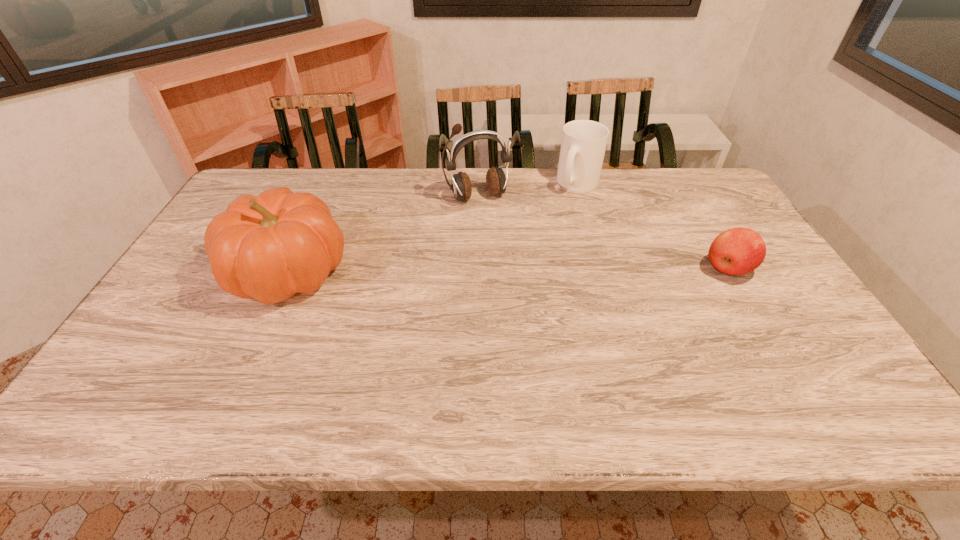
You are a GUI agent. You are given a task and a screenshot of the screen. Output one action in this format:
    pyautogui.click(x=<x>, y=<y>)
    Task: Click on the pumpkin
    Image resolution: width=960 pixels, height=540 pixels.
    Given the screenshot: What is the action you would take?
    pyautogui.click(x=269, y=247)

Locate an element on the screen. This screenshot has height=540, width=960. apple is located at coordinates (737, 251).

This screenshot has height=540, width=960. I want to click on the shortest object, so click(737, 251).

Image resolution: width=960 pixels, height=540 pixels. Identify the location of the second object from left to right. (496, 181).

Identify the location of the third object from left to right. This screenshot has width=960, height=540. (583, 145).

Find the location of `the third tallest object`. the third tallest object is located at coordinates (583, 145).

This screenshot has height=540, width=960. Find the location of `vacant space located 0.110m on the back of the pumpkin`. vacant space located 0.110m on the back of the pumpkin is located at coordinates (315, 213).

I want to click on vacant space situated 0.100m on the front of the rightmost object, so click(754, 314).

Identify the location of free space located on the ear pads of the second object from left to right. The image size is (960, 540). (503, 240).

Where is `free region located on the ear pads of the second object from left to right`? free region located on the ear pads of the second object from left to right is located at coordinates (515, 264).